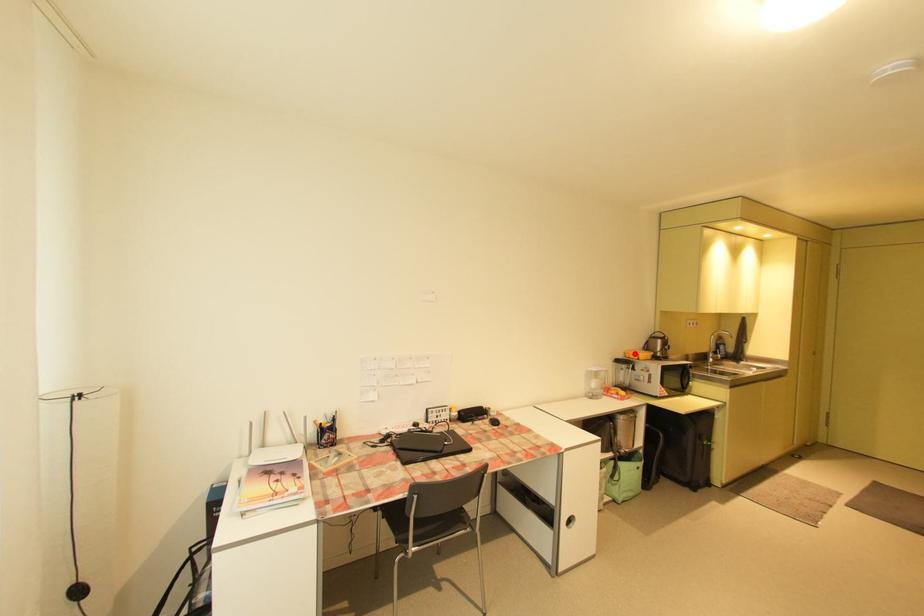
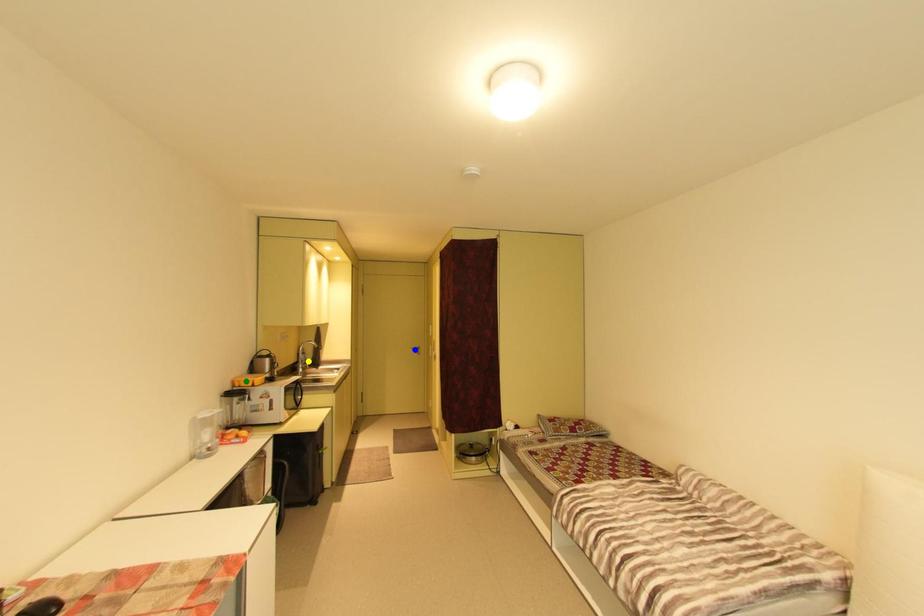
Question: I am providing you with two images of the same scene from different viewpoints. A red point is marked on the first image. You are given multiple points on the second image. In image 2, which mark is for the same physical point as the one in image 1?

Choices:
 (A) blue point
 (B) green point
 (C) yellow point

Answer: (B)